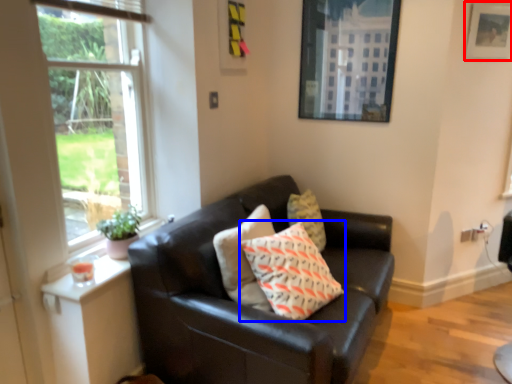
Question: Which of the following is the closest to the observer, picture frame (highlighted by a red box) or pillow (highlighted by a blue box)?

Choices:
 (A) picture frame
 (B) pillow

Answer: (B)